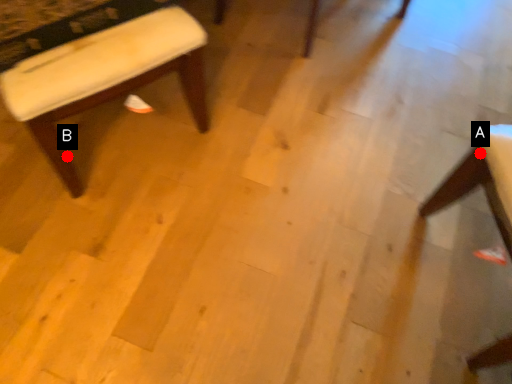
Question: Two points are circled on the image, labeled by A and B beside each circle. Which point is farther from the camera taking this photo?

Choices:
 (A) A is further
 (B) B is further

Answer: (B)